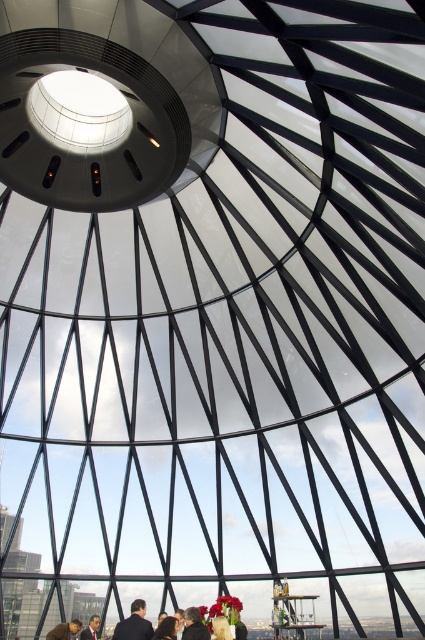
Does dark suit at lower left appear on the right side of dark suit at center?

In fact, dark suit at lower left is to the left of dark suit at center.

Can you confirm if dark suit at lower left is bigger than dark suit at center?

Indeed, dark suit at lower left has a larger size compared to dark suit at center.

The image size is (425, 640). What do you see at coordinates (65, 628) in the screenshot?
I see `dark suit at lower left` at bounding box center [65, 628].

Locate an element on the screen. dark suit at lower left is located at coordinates (65, 628).

Is dark blue suit at lower center further to the viewer compared to smooth skin person at lower center?

No, it is in front of smooth skin person at lower center.

Is the position of dark blue suit at lower center less distant than that of smooth skin person at lower center?

That is True.

Does point (141, 614) lie behind point (189, 612)?

That is False.

At what (x,y) coordinates should I click in order to perform the action: click on dark blue suit at lower center. Please return your answer as a coordinate pair (x, y). Looking at the image, I should click on (135, 624).

Who is higher up, dark blue suit at lower center or dark brown hair at lower center?

dark blue suit at lower center

Locate an element on the screen. dark blue suit at lower center is located at coordinates (135, 624).

Locate an element on the screen. Image resolution: width=425 pixels, height=640 pixels. dark blue suit at lower center is located at coordinates (135, 624).